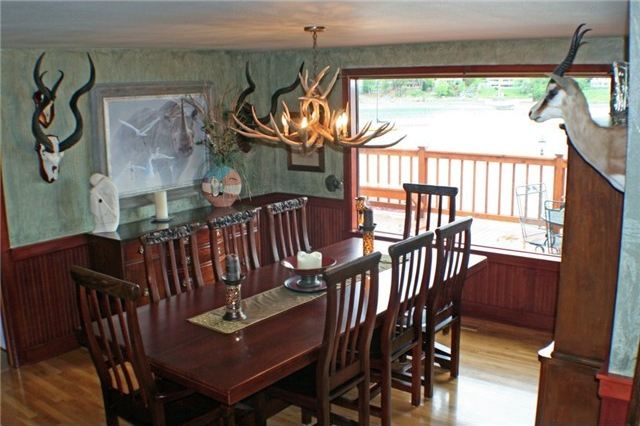
Locate an element on the screen. chairs is located at coordinates (118, 341), (173, 272), (244, 235), (285, 224), (440, 203), (448, 246), (416, 281), (356, 337).